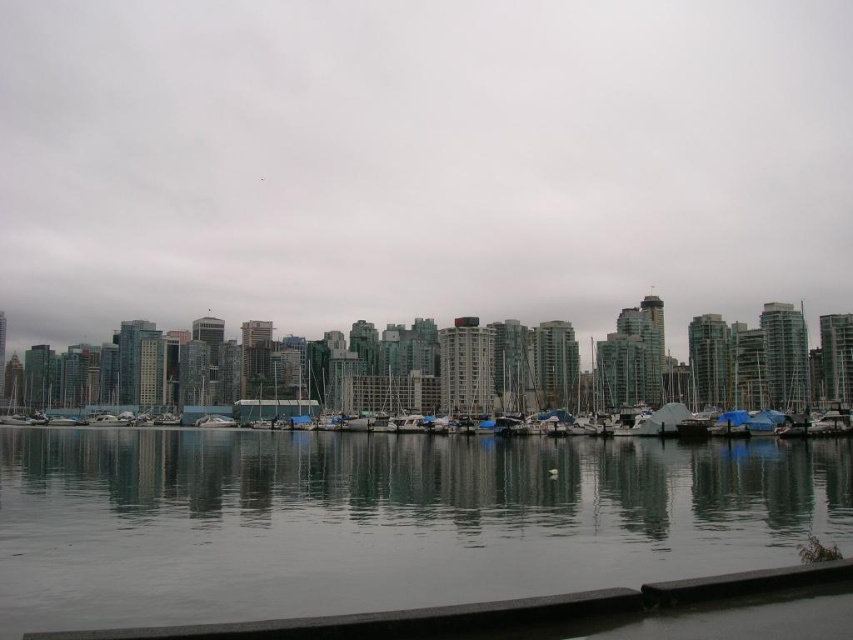
Can you confirm if transparent glass skyscrapers at center is positioned to the left of white glossy boat at center?

No, transparent glass skyscrapers at center is not to the left of white glossy boat at center.

Who is positioned more to the right, transparent glass skyscrapers at center or white glossy boat at center?

transparent glass skyscrapers at center

I want to click on transparent glass skyscrapers at center, so click(x=421, y=163).

Identify the location of transparent glass skyscrapers at center. (421, 163).

Can you confirm if smooth gray water at center is smaller than white glossy boat at center?

No.

Who is positioned more to the left, smooth gray water at center or white glossy boat at center?

From the viewer's perspective, white glossy boat at center appears more on the left side.

Between point (210, 609) and point (227, 426), which one is positioned behind?

The point (227, 426) is more distant.

Identify the location of smooth gray water at center. Image resolution: width=853 pixels, height=640 pixels. (383, 518).

Looking at this image, is the position of transparent glass skyscrapers at center less distant than that of smooth gray water at center?

No, it is not.

Which of these two, transparent glass skyscrapers at center or smooth gray water at center, stands taller?

Standing taller between the two is transparent glass skyscrapers at center.

Who is more distant from viewer, (183, 232) or (553, 492)?

The point (183, 232) is behind.

What are the coordinates of `transparent glass skyscrapers at center` in the screenshot? It's located at (421, 163).